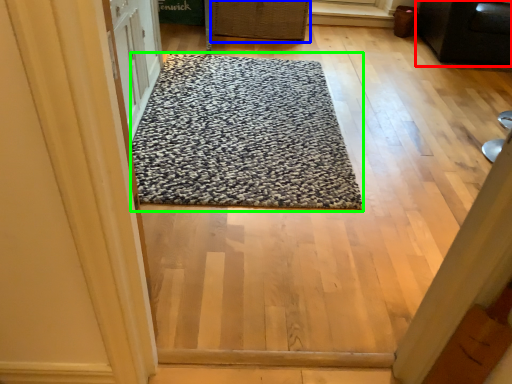
Question: Which object is positioned closest to furniture (highlighted by a red box)? Select from basket (highlighted by a blue box) and mat (highlighted by a green box).

Choices:
 (A) basket
 (B) mat

Answer: (A)